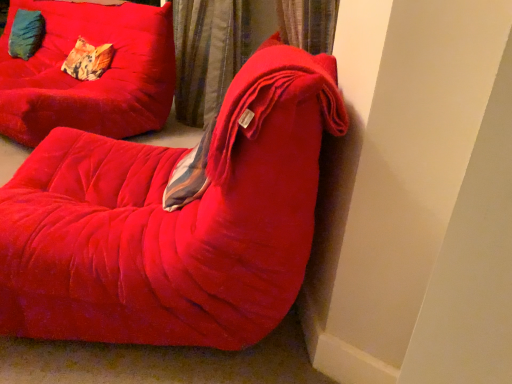
Question: Can you confirm if patterned fabric pillow at upper left, positioned as the 2th pillow in left-to-right order, is positioned to the right of velvet red chair at center, which is counted as the first furniture, starting from the front?

Choices:
 (A) yes
 (B) no

Answer: (B)

Question: From a real-world perspective, is patterned fabric pillow at upper left, positioned as the 2th pillow in left-to-right order, located higher than velvet red chair at center, which is counted as the 2th furniture, starting from the back?

Choices:
 (A) no
 (B) yes

Answer: (B)

Question: From the image's perspective, is patterned fabric pillow at upper left, which appears as the 1th pillow when viewed from the right, above velvet red chair at center, which is counted as the first furniture, starting from the front?

Choices:
 (A) yes
 (B) no

Answer: (A)

Question: From the image's perspective, is patterned fabric pillow at upper left, which is counted as the 1th pillow, starting from the front, beneath velvet red chair at center, which is counted as the first furniture, starting from the front?

Choices:
 (A) yes
 (B) no

Answer: (B)

Question: Considering the relative sizes of patterned fabric pillow at upper left, the 2th pillow in the back-to-front sequence, and velvet red chair at center, which is counted as the first furniture, starting from the front, in the image provided, is patterned fabric pillow at upper left, the 2th pillow in the back-to-front sequence, smaller than velvet red chair at center, which is counted as the first furniture, starting from the front,?

Choices:
 (A) yes
 (B) no

Answer: (A)

Question: Does patterned fabric pillow at upper left, positioned as the 2th pillow in left-to-right order, have a greater height compared to velvet red chair at center, which is counted as the 2th furniture, starting from the back?

Choices:
 (A) yes
 (B) no

Answer: (B)

Question: Considering the relative positions of velvet curtain at upper center and velvet red chair at center, which is counted as the first furniture, starting from the front, in the image provided, is velvet curtain at upper center to the right of velvet red chair at center, which is counted as the first furniture, starting from the front, from the viewer's perspective?

Choices:
 (A) yes
 (B) no

Answer: (A)

Question: From the image's perspective, is velvet curtain at upper center located beneath velvet red chair at center, which is counted as the 2th furniture, starting from the back?

Choices:
 (A) no
 (B) yes

Answer: (A)

Question: Can you confirm if velvet curtain at upper center is smaller than velvet red chair at center, which is counted as the first furniture, starting from the front?

Choices:
 (A) no
 (B) yes

Answer: (B)

Question: Is velvet curtain at upper center positioned far away from velvet red chair at center, which is counted as the 2th furniture, starting from the back?

Choices:
 (A) no
 (B) yes

Answer: (B)

Question: Is velvet curtain at upper center positioned with its back to velvet red chair at center, which is counted as the 2th furniture, starting from the back?

Choices:
 (A) no
 (B) yes

Answer: (A)

Question: Is velvet curtain at upper center beside velvet red chair at center, which is counted as the 2th furniture, starting from the back?

Choices:
 (A) no
 (B) yes

Answer: (A)

Question: Can you see velvet red chair at center, which is counted as the first furniture, starting from the front, touching velvet cushion at upper left, which is the 2th pillow in right-to-left order?

Choices:
 (A) yes
 (B) no

Answer: (B)